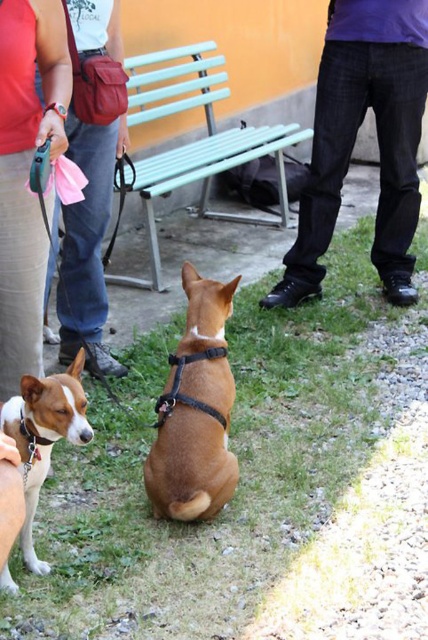
You are a photographer setting up for a group photo. You have a matte pink shirt at upper left and a light blue plastic bench at center in your frame. Which object is narrower?

The matte pink shirt at upper left is narrower than the light blue plastic bench at center.

You are standing in the park and want to walk from point point(x=374, y=300) to point(x=29, y=477). Which direction should you head?

You should head downward because point(x=374, y=300) is further to the viewer than point(x=29, y=477), so moving towards it would mean going in the direction of decreasing depth.

You are a delivery robot with a 12 inch wide package. You need to move from the brushed leather bag at left to the brown grass at center to drop off the package. Can you fit through the space between them?

The brown grass at center and brushed leather bag at left are 36.49 inches apart from each other. Since your package is 12 inches wide, there is enough space to fit through the 36.49 inch gap between them.